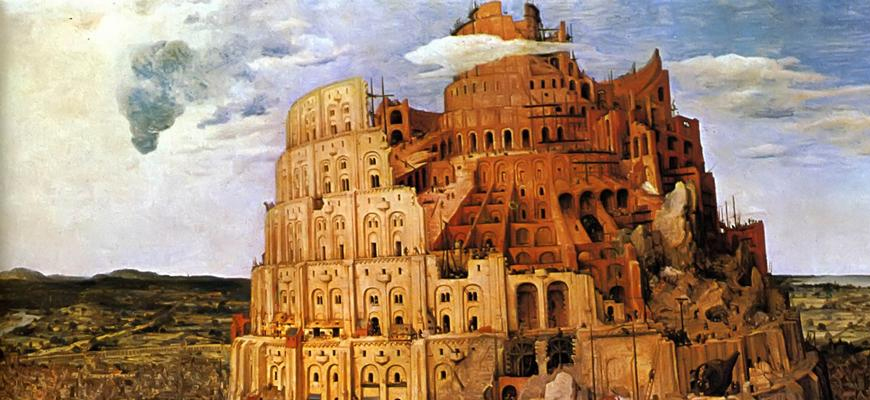
Where is `window`? window is located at coordinates (469, 298).